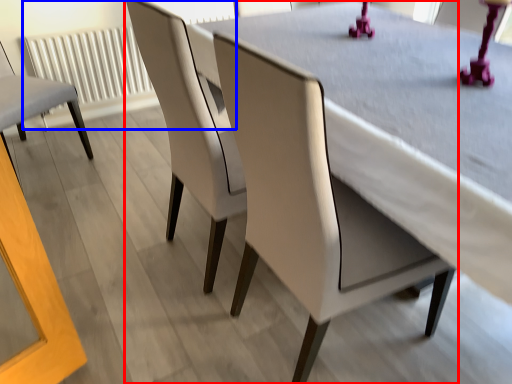
Question: Which object appears farthest to the camera in this image, chair (highlighted by a red box) or radiator (highlighted by a blue box)?

Choices:
 (A) chair
 (B) radiator

Answer: (B)